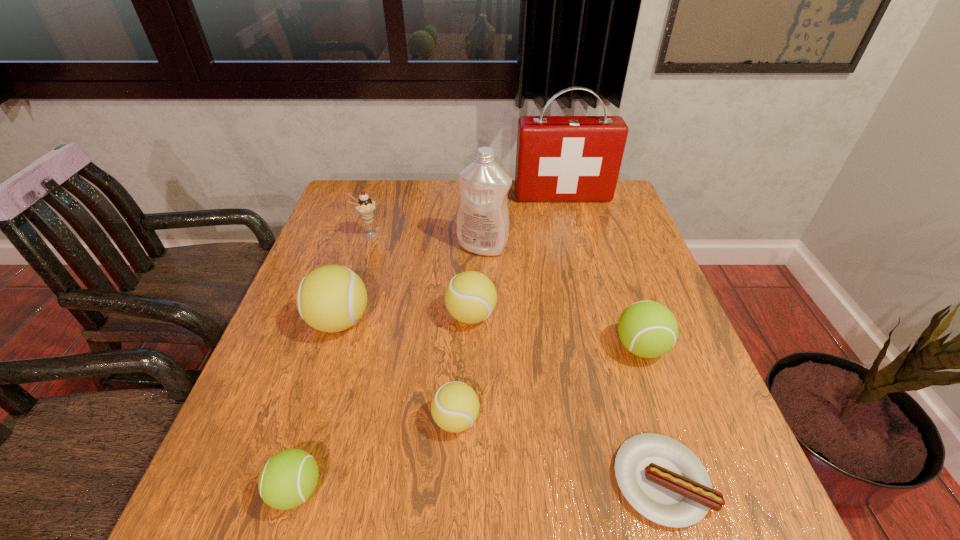
Locate an element on the screen. The height and width of the screenshot is (540, 960). sausage present at the right edge is located at coordinates (663, 480).

Locate an element on the screen. The height and width of the screenshot is (540, 960). object at the near left corner is located at coordinates (288, 479).

The width and height of the screenshot is (960, 540). Identify the location of object located in the far right corner section of the desktop. (559, 158).

Find the location of a particular element. Image resolution: width=960 pixels, height=540 pixels. object that is at the near right corner is located at coordinates (663, 480).

Where is `vacant space at the far edge`? This screenshot has width=960, height=540. vacant space at the far edge is located at coordinates (457, 180).

The height and width of the screenshot is (540, 960). In order to click on vacant area at the near edge in this screenshot , I will do `click(628, 526)`.

Locate an element on the screen. The height and width of the screenshot is (540, 960). blank space at the left edge of the desktop is located at coordinates (256, 460).

The width and height of the screenshot is (960, 540). I want to click on vacant region at the right edge of the desktop, so click(x=650, y=254).

I want to click on free spot at the far left corner of the desktop, so click(x=385, y=196).

Identify the location of free point at the near right corner. (745, 510).